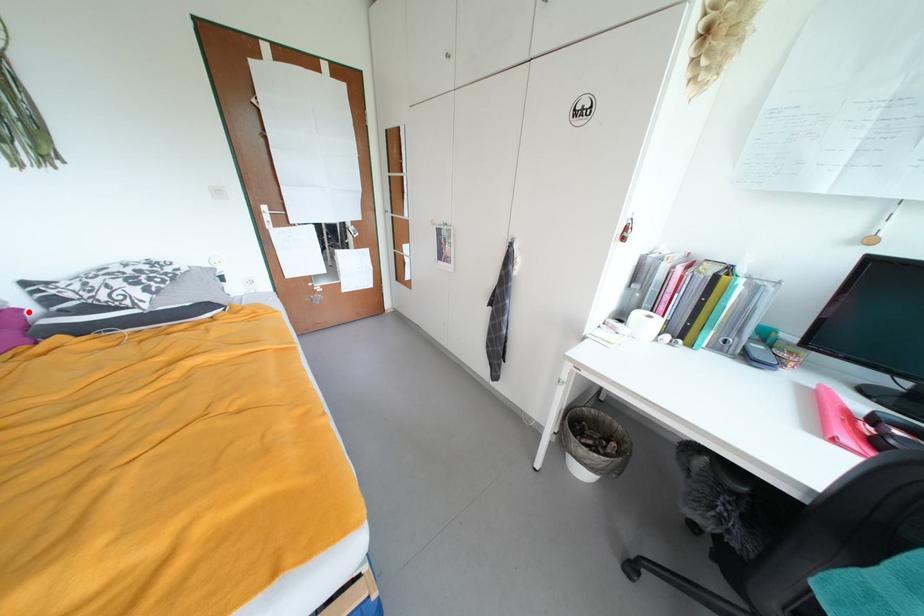
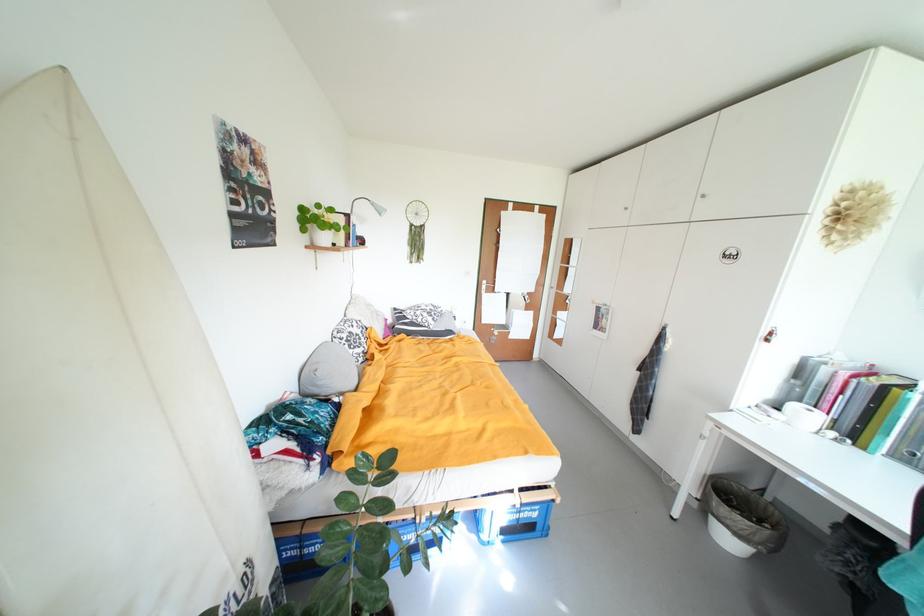
Locate, in the second image, the point that corresponds to the highlighted location in the first image.

(394, 322)